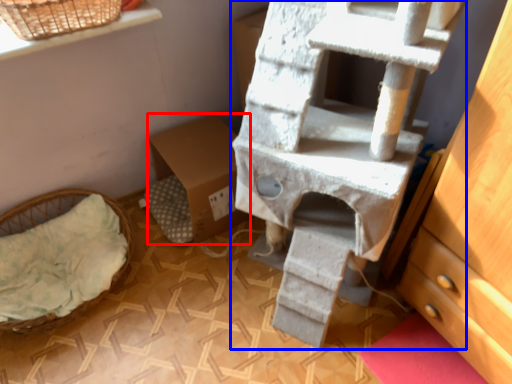
Question: Which of the following is the closest to the observer, cardboard box (highlighted by a red box) or bunk bed (highlighted by a blue box)?

Choices:
 (A) cardboard box
 (B) bunk bed

Answer: (B)